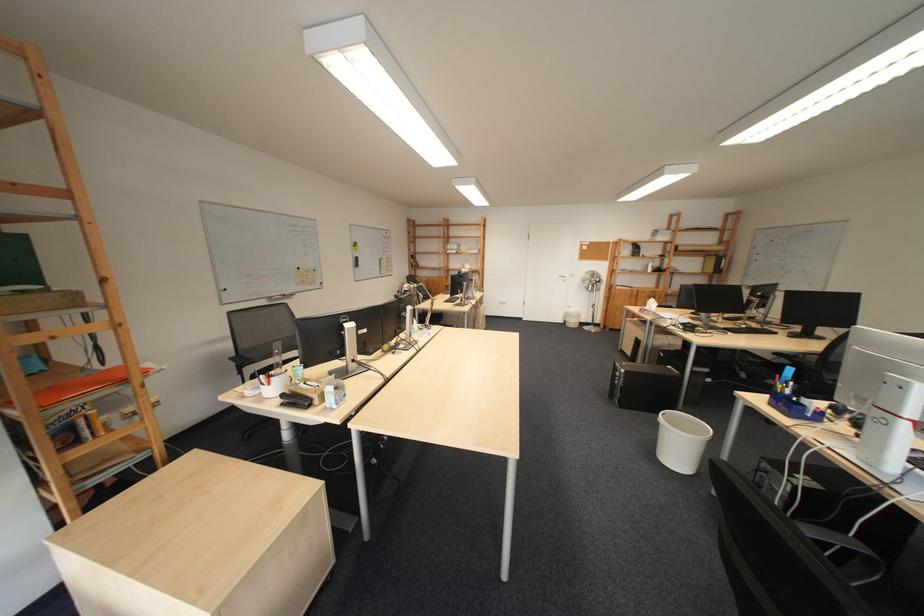
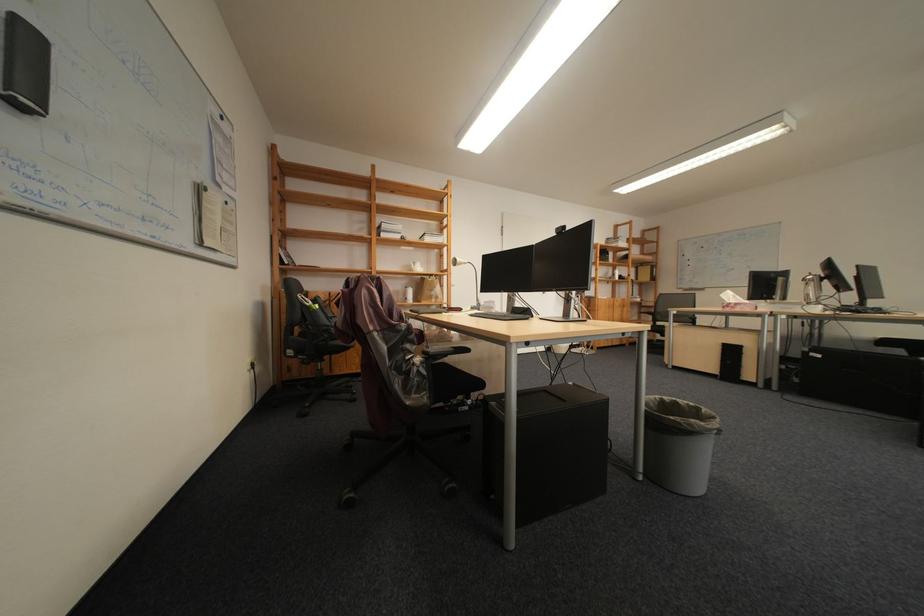
Locate, in the second image, the point that corresponds to pixel 657 313 in the first image.

(747, 309)